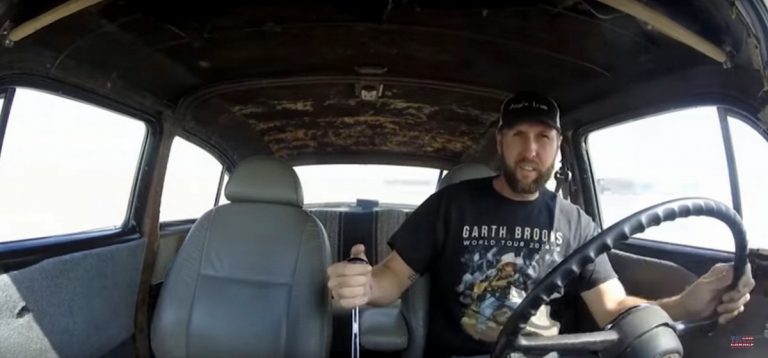
I want to click on arm rest, so (382, 321).